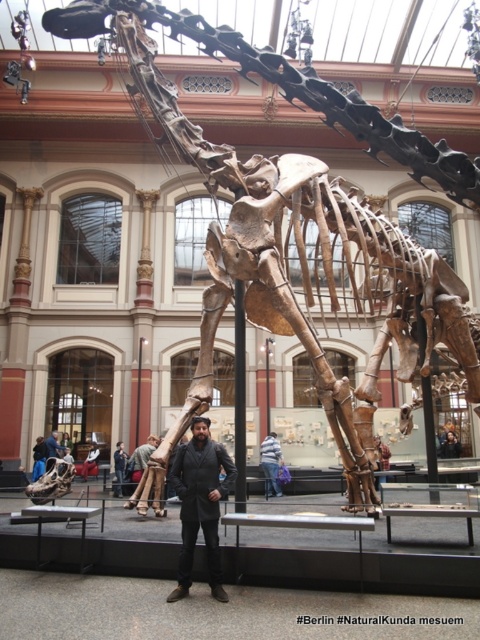
Describe the element at coordinates (200, 502) in the screenshot. I see `dark gray coat at center` at that location.

Is the position of dark gray coat at center more distant than that of dark brown leather jacket at center?

No, dark gray coat at center is closer to the viewer.

Who is more forward, (226, 600) or (131, 476)?

Point (226, 600) is more forward.

Locate an element on the screen. Image resolution: width=480 pixels, height=640 pixels. dark gray coat at center is located at coordinates (200, 502).

Who is lower down, bone-like skeleton at center or dark brown leather jacket at center?

dark brown leather jacket at center

Can you confirm if bone-like skeleton at center is positioned to the left of dark brown leather jacket at center?

No, bone-like skeleton at center is not to the left of dark brown leather jacket at center.

Is point (82, 12) positioned before point (142, 474)?

Yes, point (82, 12) is in front of point (142, 474).

Identify the location of bone-like skeleton at center. This screenshot has height=640, width=480. (297, 225).

Does dark gray coat at center appear on the right side of striped shirt at center?

No, dark gray coat at center is not to the right of striped shirt at center.

Does dark gray coat at center have a lesser width compared to striped shirt at center?

Indeed, dark gray coat at center has a lesser width compared to striped shirt at center.

Where is `dark gray coat at center`? The width and height of the screenshot is (480, 640). dark gray coat at center is located at coordinates (200, 502).